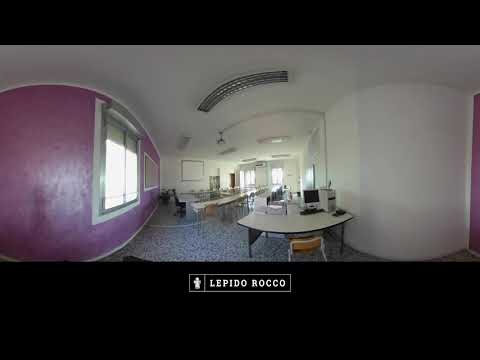
Find the location of a particular element. The width and height of the screenshot is (480, 360). floor is located at coordinates coord(183,238), coord(225,234).